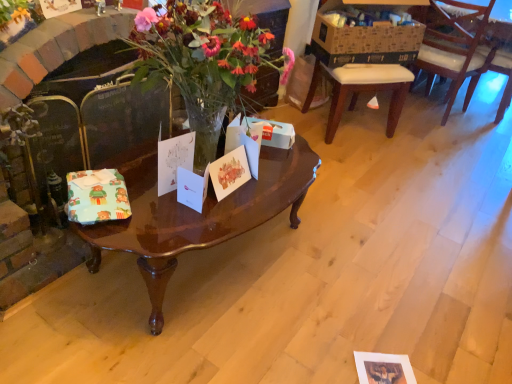
Where is `free space in front of wooden chair at right`? The height and width of the screenshot is (384, 512). free space in front of wooden chair at right is located at coordinates [478, 124].